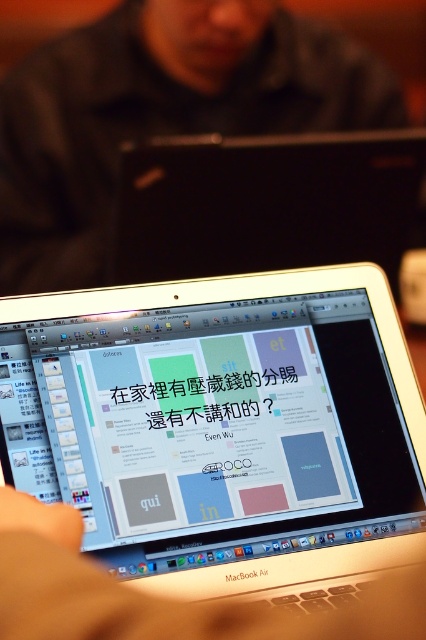
Does silver metallic laptop at center have a greater width compared to white plastic laptop at center?

Incorrect, silver metallic laptop at center's width does not surpass white plastic laptop at center's.

Which is in front, point (186, 468) or point (190, 257)?

Point (186, 468)

The width and height of the screenshot is (426, 640). Find the location of `silver metallic laptop at center`. silver metallic laptop at center is located at coordinates (210, 426).

Who is lower down, black matte laptop at center or white plastic laptop at center?

Positioned lower is white plastic laptop at center.

Locate an element on the screen. black matte laptop at center is located at coordinates (158, 115).

Does silver metallic laptop at center appear on the left side of black matte laptop at center?

No, silver metallic laptop at center is not to the left of black matte laptop at center.

Find the location of a particular element. The image size is (426, 640). silver metallic laptop at center is located at coordinates (210, 426).